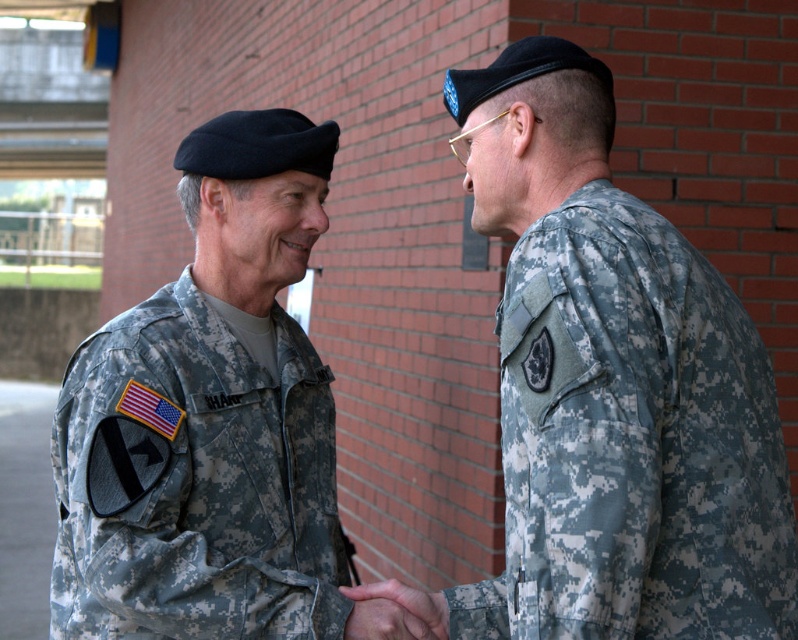
Is camouflage uniform at right further to the viewer compared to camouflage fabric hand at center?

No, it is not.

Does camouflage uniform at right appear on the left side of camouflage fabric hand at center?

In fact, camouflage uniform at right is to the right of camouflage fabric hand at center.

Which is in front, point (573, 104) or point (443, 608)?

Point (573, 104) is more forward.

This screenshot has width=798, height=640. Find the location of `camouflage uniform at right`. camouflage uniform at right is located at coordinates (614, 387).

Can you confirm if camouflage fabric uniform at left is thinner than camouflage fabric hand at center?

No, camouflage fabric uniform at left is not thinner than camouflage fabric hand at center.

Does camouflage fabric uniform at left have a lesser height compared to camouflage fabric hand at center?

No, camouflage fabric uniform at left is not shorter than camouflage fabric hand at center.

Is point (70, 602) positioned before point (429, 605)?

No, it is behind (429, 605).

This screenshot has height=640, width=798. Find the location of `camouflage fabric uniform at left`. camouflage fabric uniform at left is located at coordinates (198, 483).

The width and height of the screenshot is (798, 640). Describe the element at coordinates (614, 387) in the screenshot. I see `camouflage uniform at right` at that location.

Which is above, camouflage uniform at right or camouflage fabric uniform at left?

camouflage uniform at right is above.

Based on the photo, who is more forward, (x=597, y=541) or (x=105, y=344)?

Point (x=597, y=541)

This screenshot has width=798, height=640. I want to click on camouflage uniform at right, so click(x=614, y=387).